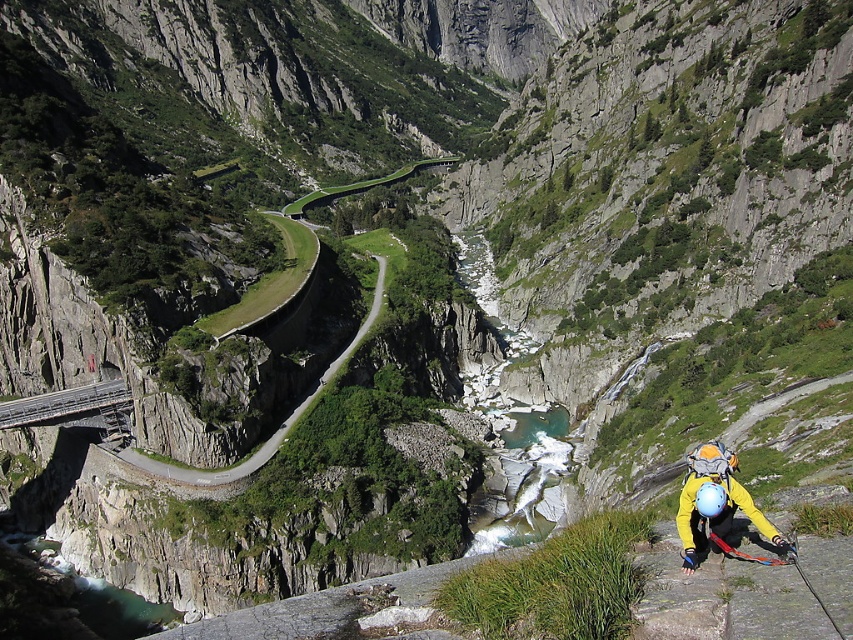
Question: Which object is positioned closest to the green asphalt road at center?

Choices:
 (A) yellow fabric helmet at lower right
 (B) metallic gray bridge at lower left

Answer: (B)

Question: Is green asphalt road at center closer to the viewer compared to metallic gray bridge at lower left?

Choices:
 (A) no
 (B) yes

Answer: (B)

Question: Among these points, which one is farthest from the camera?

Choices:
 (A) (67, 403)
 (B) (379, 285)

Answer: (B)

Question: Estimate the real-world distances between objects in this image. Which object is farther from the yellow fabric helmet at lower right?

Choices:
 (A) metallic gray bridge at lower left
 (B) green asphalt road at center

Answer: (A)

Question: Is green asphalt road at center further to camera compared to metallic gray bridge at lower left?

Choices:
 (A) yes
 (B) no

Answer: (B)

Question: Does green asphalt road at center have a greater width compared to metallic gray bridge at lower left?

Choices:
 (A) yes
 (B) no

Answer: (A)